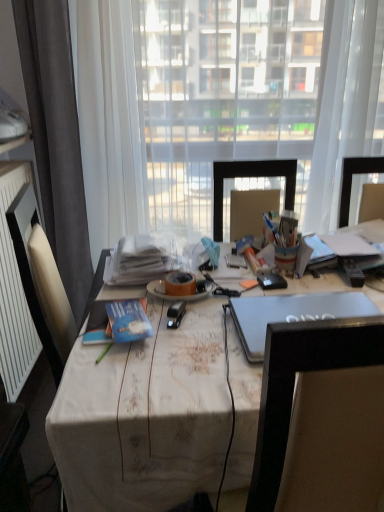
Where is `spots to the right of blue matte book at center, placed as the second book when sorted from top to bottom`? The image size is (384, 512). spots to the right of blue matte book at center, placed as the second book when sorted from top to bottom is located at coordinates (194, 332).